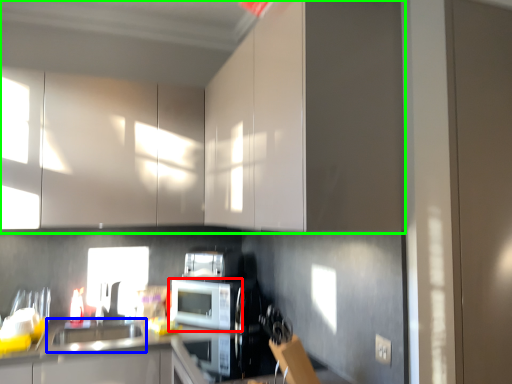
Question: Which object is the farthest from microwave oven (highlighted by a red box)? Choose among these: sink (highlighted by a blue box) or cabinetry (highlighted by a green box).

Choices:
 (A) sink
 (B) cabinetry

Answer: (B)